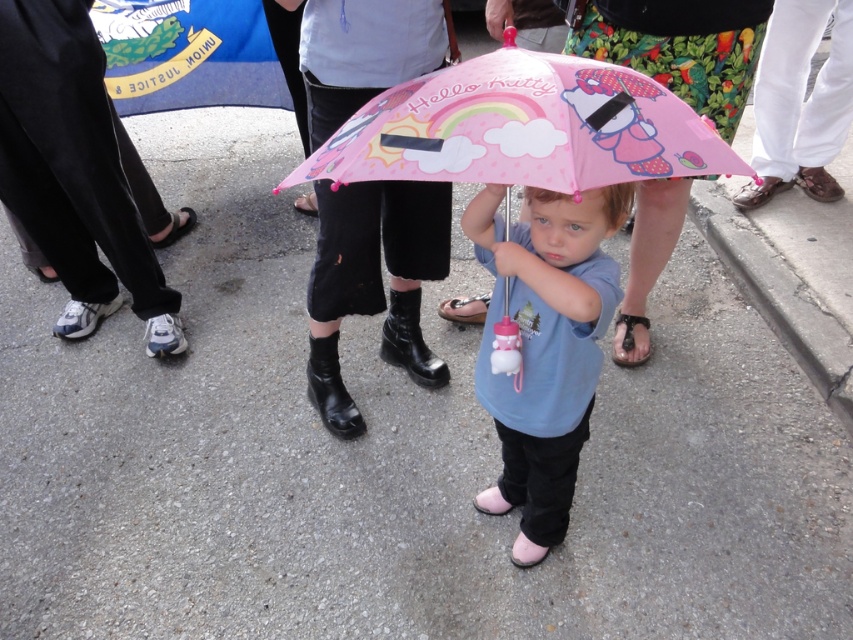
Looking at this image, you are a photographer trying to capture a closeup of the child holding the pink matte umbrella at center and wearing the pink leather sandal at center. If the umbrella is wider than the sandal, will it block the view of the sandal in the photo?

The pink matte umbrella at center might be wider than pink leather sandal at center, so there is a possibility that the umbrella could block the view of the sandal in the photo.

You are a photographer trying to capture the matte pink umbrella at center and the black leather sandal at lower center in a single frame. Based on their positions, which object should you focus on first to ensure both are in the frame?

The matte pink umbrella at center is in front of the black leather sandal at lower center, so you should focus on the matte pink umbrella at center first to ensure both are in the frame.